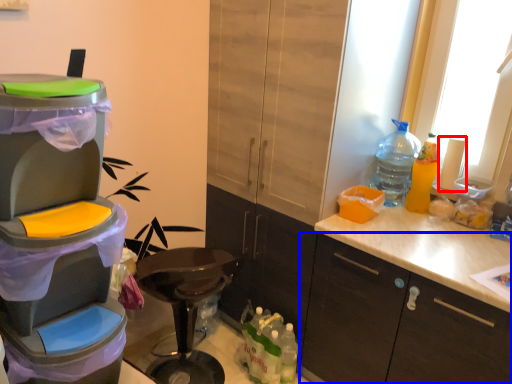
Question: Which object is closer to the camera taking this photo, toilet paper (highlighted by a red box) or cabinetry (highlighted by a blue box)?

Choices:
 (A) toilet paper
 (B) cabinetry

Answer: (B)